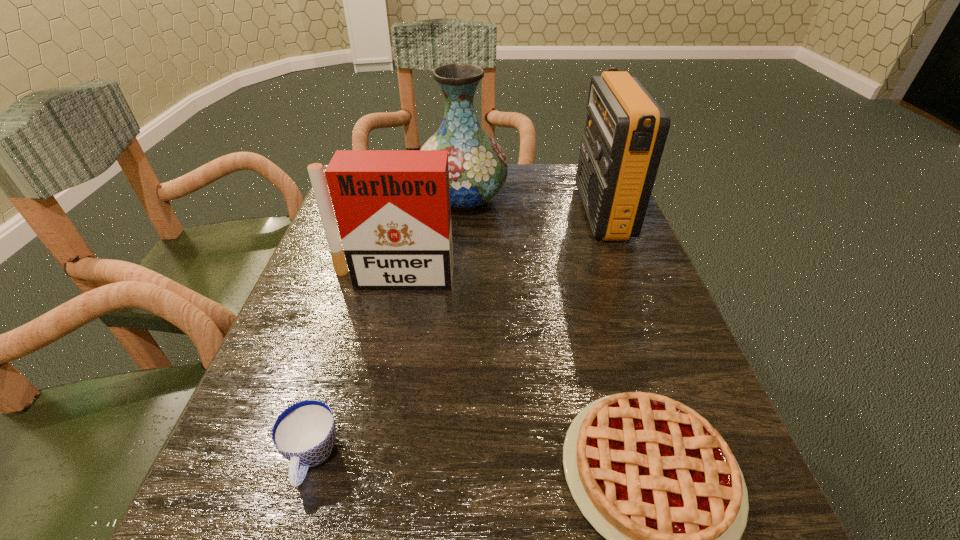
Identify the location of free space that is in between the vase and the radio receiver. point(533,205).

I want to click on empty space that is in between the cigarette case and the radio receiver, so click(497, 245).

Identify the location of free spot between the cigarette case and the cup. This screenshot has height=540, width=960. (352, 368).

Locate which object ranks in proximity to the third nearest object. Please provide its 2D coordinates. Your answer should be formatted as a tuple, i.e. [(x, y)], where the tuple contains the x and y coordinates of a point satisfying the conditions above.

[(478, 169)]

Identify which object is located as the third nearest to the vase. Please provide its 2D coordinates. Your answer should be formatted as a tuple, i.e. [(x, y)], where the tuple contains the x and y coordinates of a point satisfying the conditions above.

[(654, 478)]

The height and width of the screenshot is (540, 960). I want to click on free space in the image that satisfies the following two spatial constraints: 1. on the front-facing side of the radio receiver; 2. on the side of the cup with the handle, so click(x=696, y=458).

Find the location of a particular element. Image resolution: width=960 pixels, height=540 pixels. blank space that satisfies the following two spatial constraints: 1. on the front-facing side of the radio receiver; 2. on the side of the second shortest object with the handle is located at coordinates (696, 458).

The width and height of the screenshot is (960, 540). What are the coordinates of `vacant region that satisfies the following two spatial constraints: 1. on the front-facing side of the radio receiver; 2. on the side of the cup with the handle` in the screenshot? It's located at (696, 458).